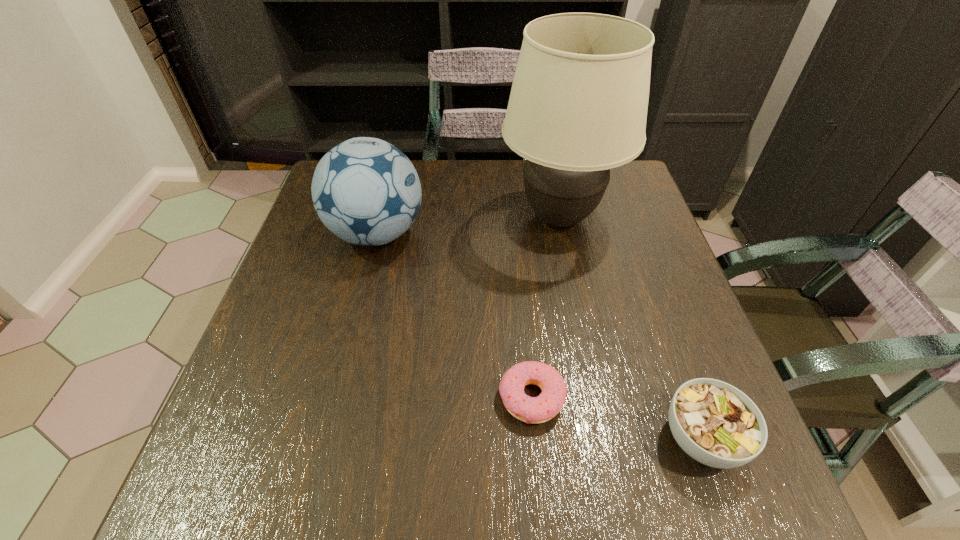
The height and width of the screenshot is (540, 960). In order to click on free space at the left edge of the desktop in this screenshot , I will do `click(322, 264)`.

In the image, there is a desktop. At what (x,y) coordinates should I click in order to perform the action: click on free space at the right edge. Please return your answer as a coordinate pair (x, y). The width and height of the screenshot is (960, 540). Looking at the image, I should click on (667, 323).

Where is `free space at the far right corner of the desktop`? The image size is (960, 540). free space at the far right corner of the desktop is located at coordinates (625, 184).

You are a GUI agent. You are given a task and a screenshot of the screen. Output one action in this format:
    pyautogui.click(x=<x>, y=<y>)
    Task: Click on the vacant region between the doughnut and the soccer ball
    This screenshot has height=540, width=960.
    Given the screenshot: What is the action you would take?
    pyautogui.click(x=454, y=316)

Locate an element on the screen. free space between the lampshade and the third shortest object is located at coordinates (468, 226).

Image resolution: width=960 pixels, height=540 pixels. I want to click on free spot between the third tallest object and the shortest object, so click(x=616, y=418).

Locate an element on the screen. This screenshot has height=540, width=960. free space between the lampshade and the shortest object is located at coordinates click(545, 308).

I want to click on vacant area that lies between the second tallest object and the tallest object, so click(468, 226).

Where is `vacant space in between the lampshade and the third tallest object`? The height and width of the screenshot is (540, 960). vacant space in between the lampshade and the third tallest object is located at coordinates (631, 328).

Locate an element on the screen. The height and width of the screenshot is (540, 960). vacant area between the leftmost object and the doughnut is located at coordinates (454, 316).